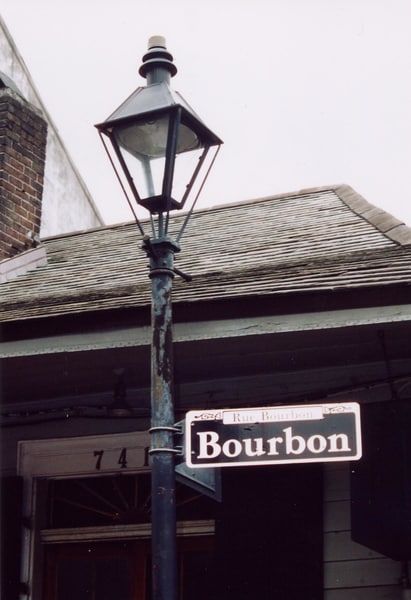
Identify the location of door. The height and width of the screenshot is (600, 411). click(68, 533).